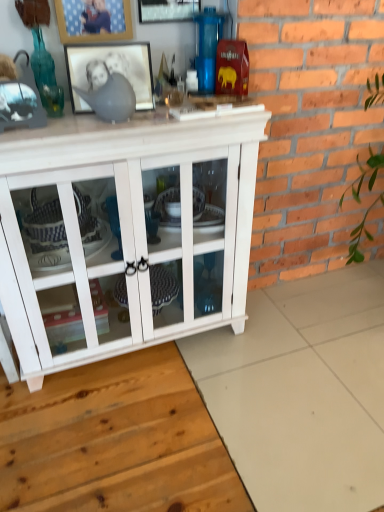
Identify the location of vacant area in front of black matte picture frame at upper center, which ranks as the 1th picture frame in bottom-to-top order. (97, 128).